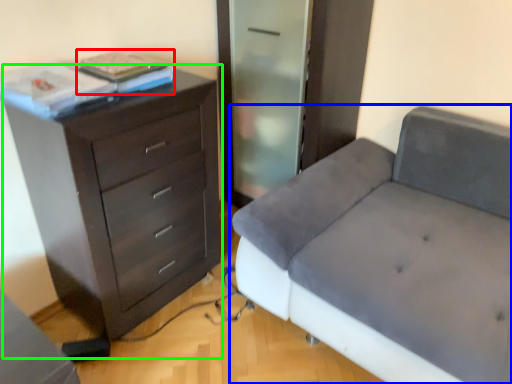
Question: Which is nearer to the book (highlighted by a red box)? studio couch (highlighted by a blue box) or chest of drawers (highlighted by a green box).

Choices:
 (A) studio couch
 (B) chest of drawers

Answer: (B)